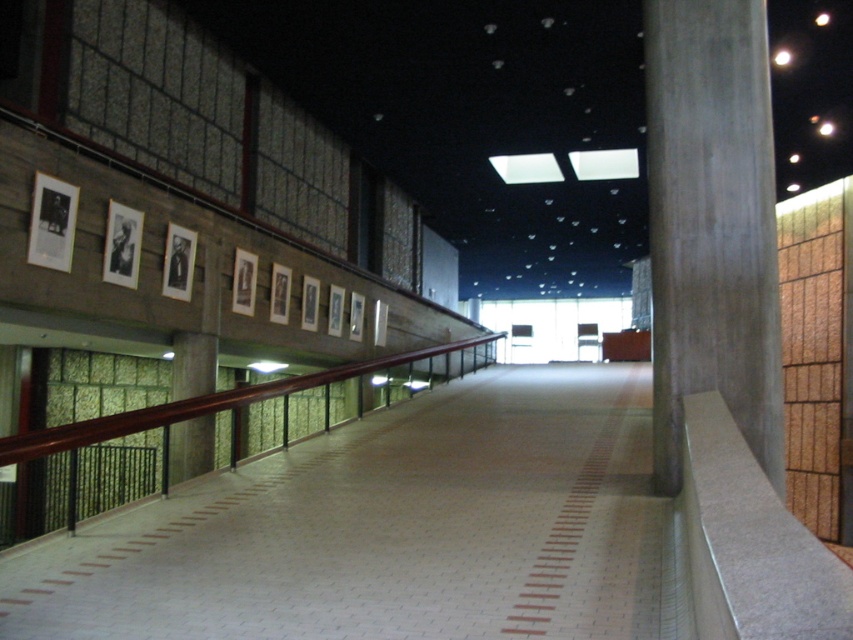
Is point (453, 573) more distant than point (770, 305)?

No, (453, 573) is in front of (770, 305).

Can you confirm if white tile floor at center is positioned to the left of gray concrete pillar at right?

Yes, white tile floor at center is to the left of gray concrete pillar at right.

The image size is (853, 640). Describe the element at coordinates (392, 529) in the screenshot. I see `white tile floor at center` at that location.

I want to click on white tile floor at center, so click(392, 529).

Where is `gray concrete pillar at right`? Image resolution: width=853 pixels, height=640 pixels. gray concrete pillar at right is located at coordinates (711, 225).

Looking at this image, which of these two, gray concrete pillar at right or brown polished wood rail at center, stands shorter?

brown polished wood rail at center is shorter.

Who is more forward, (671,285) or (4,512)?

Point (671,285) is in front.

The height and width of the screenshot is (640, 853). Identify the location of gray concrete pillar at right. tap(711, 225).

The image size is (853, 640). What do you see at coordinates (392, 529) in the screenshot? I see `white tile floor at center` at bounding box center [392, 529].

Consider the image. Which is above, white tile floor at center or brown polished wood rail at center?

brown polished wood rail at center

Where is `white tile floor at center`? The width and height of the screenshot is (853, 640). white tile floor at center is located at coordinates (392, 529).

This screenshot has width=853, height=640. Identify the location of white tile floor at center. (392, 529).